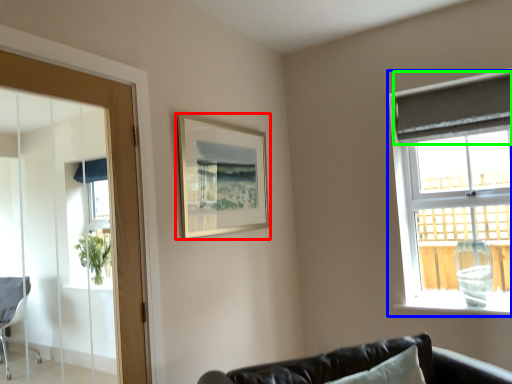
Question: Which object is positioned farthest from picture frame (highlighted by a red box)? Select from window (highlighted by a blue box) and curtain (highlighted by a green box).

Choices:
 (A) window
 (B) curtain

Answer: (B)